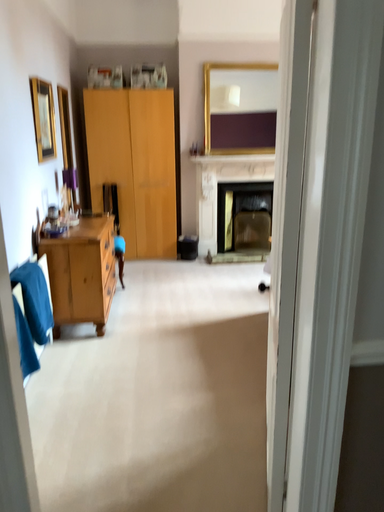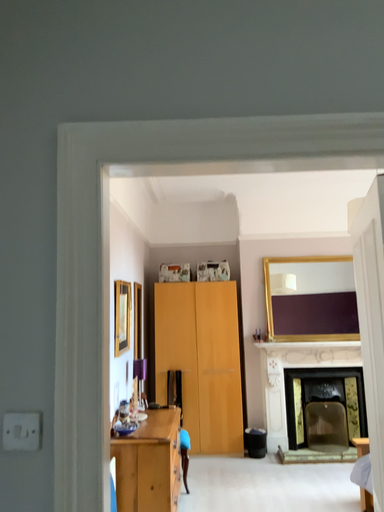
Question: Which way did the camera rotate in the video?

Choices:
 (A) rotated left
 (B) rotated right

Answer: (A)